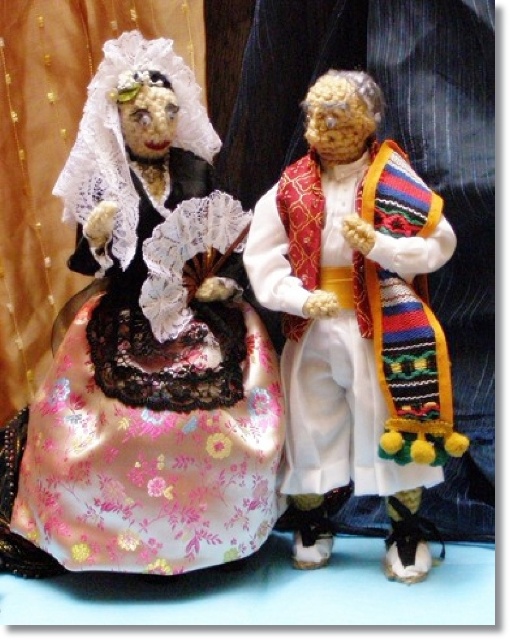
You are observing two dolls in a display. There is a point marked at coordinates (147, 349). Which object does this point correspond to?

The point at coordinates (147, 349) corresponds to the silky floral dress at left.

You are an art curator examining the dolls in the image. The silky floral dress at left and the traditional outfit on the right doll are both present. Based on their positions, which object is closer to the center of the image?

The silky floral dress at left is located at point (147, 349), which is closer to the center of the image compared to the traditional outfit on the right doll. Therefore, the silky floral dress at left is closer to the center.

You are a tailor trying to determine if the silky floral dress at left can be folded and placed inside the white satin vest at center. Based on their sizes, is this possible?

The silky floral dress at left might be wider than white satin vest at center, so it may not fit inside the vest.